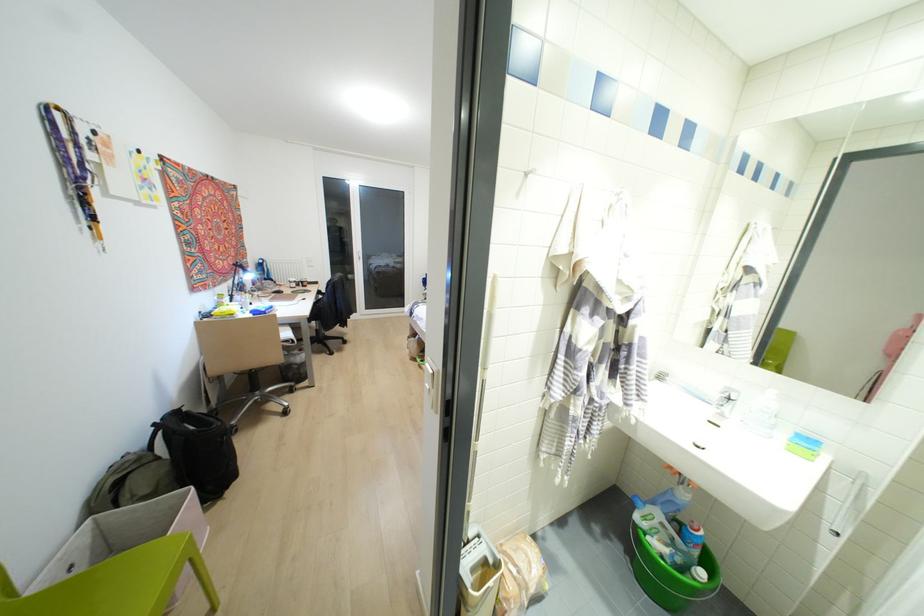
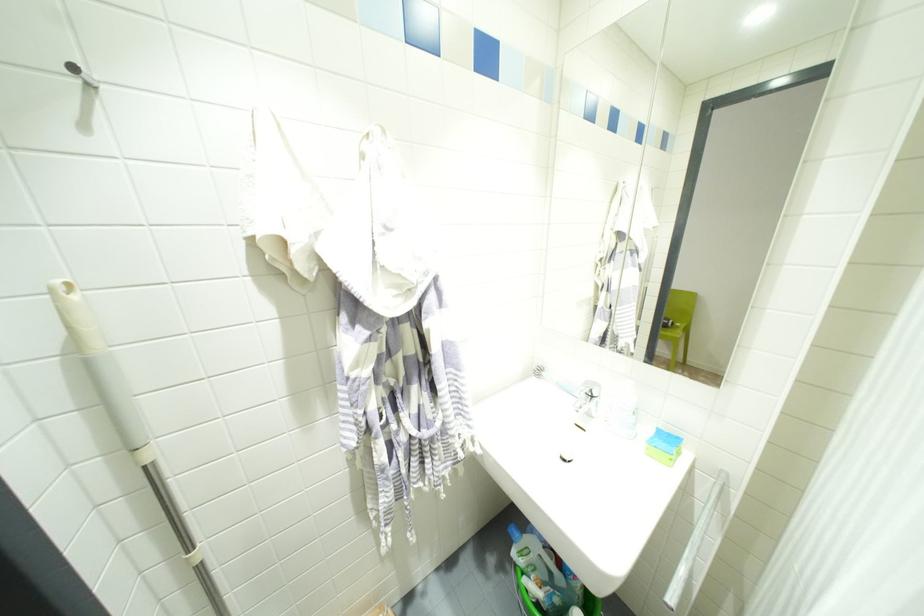
Find the pixel in the second image that matches [807,440] in the first image.

(667, 439)